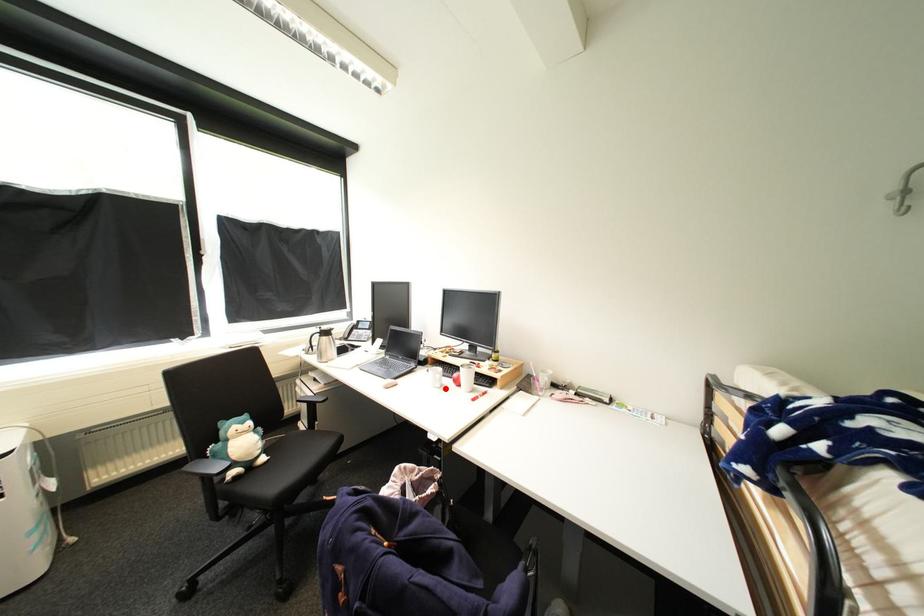
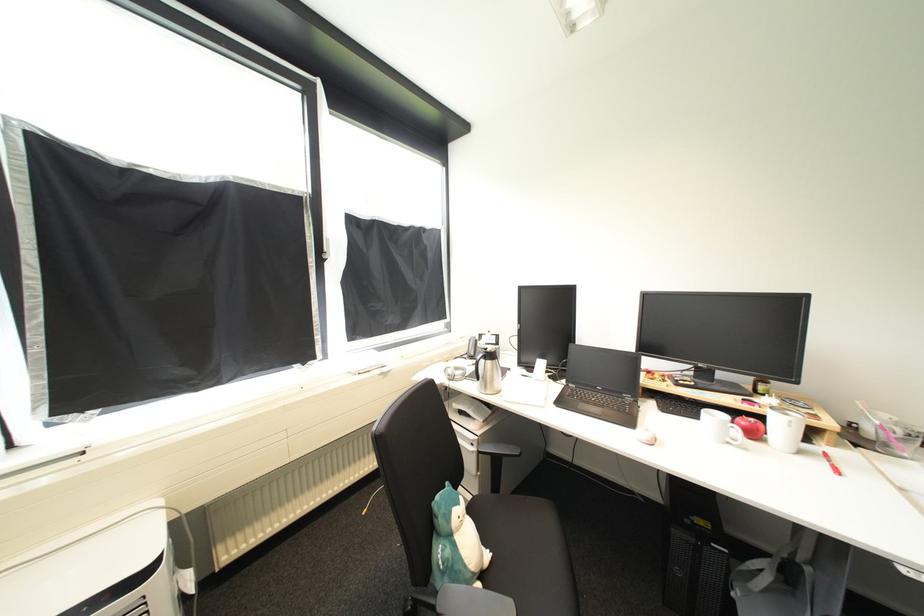
In the second image, find the point that corresponds to the highlighted location in the first image.

(736, 445)